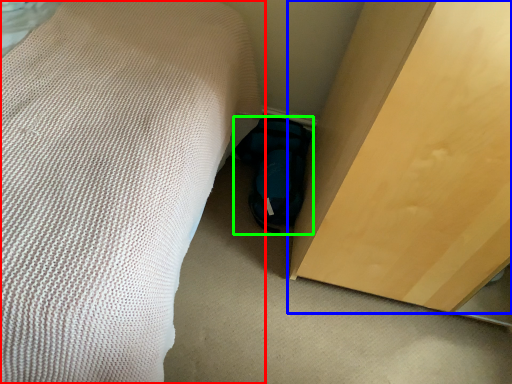
Question: Considering the real-world distances, which object is farthest from bed (highlighted by a red box)? furniture (highlighted by a blue box) or footwear (highlighted by a green box)?

Choices:
 (A) furniture
 (B) footwear

Answer: (B)